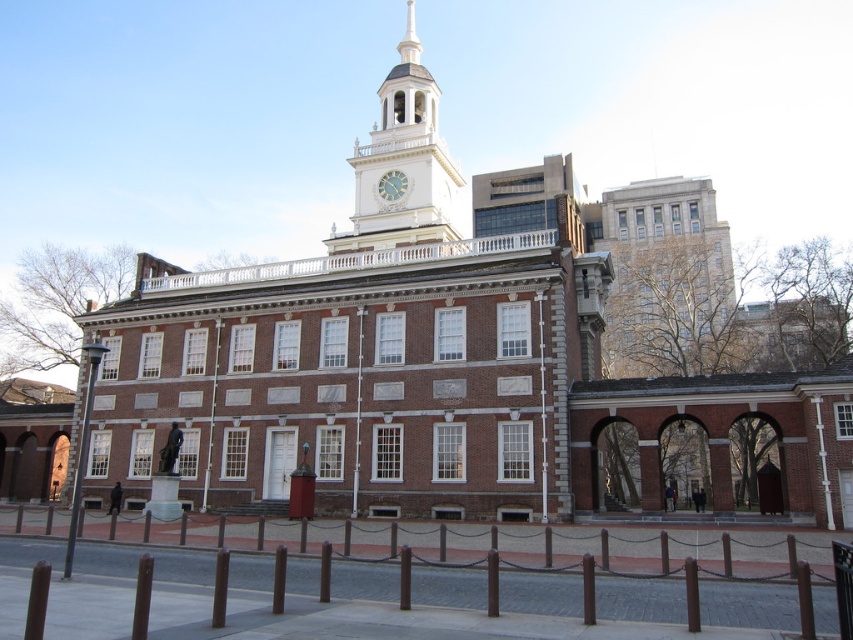
From the picture: Does white painted wood clock tower at upper center appear over matte white clock at center?

Correct, white painted wood clock tower at upper center is located above matte white clock at center.

Does point (392, 212) come closer to viewer compared to point (393, 180)?

Yes, point (392, 212) is closer to viewer.

This screenshot has width=853, height=640. What do you see at coordinates (404, 164) in the screenshot?
I see `white painted wood clock tower at upper center` at bounding box center [404, 164].

Identify the location of white painted wood clock tower at upper center. The image size is (853, 640). (404, 164).